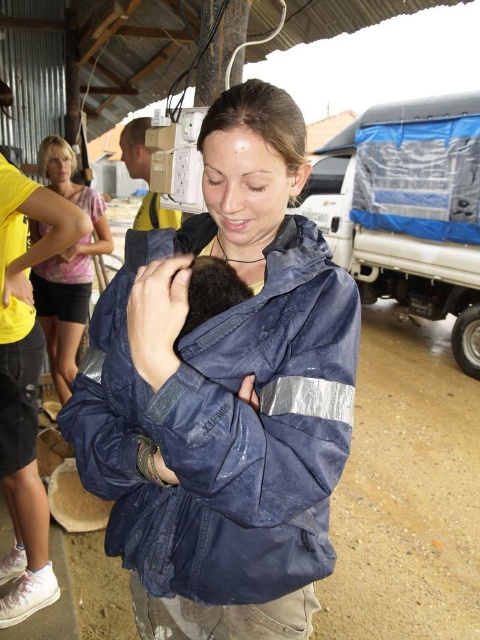
Is point (186, 349) behind point (47, 262)?

No, (186, 349) is closer to viewer.

At what (x,y) coordinates should I click in order to perform the action: click on navy blue jacket at center. Please return your answer as a coordinate pair (x, y). The image size is (480, 640). Looking at the image, I should click on (224, 394).

Is point (229, 147) positioned in front of point (73, 356)?

Yes.

At what (x,y) coordinates should I click in order to perform the action: click on navy blue jacket at center. Please return your answer as a coordinate pair (x, y). The image size is (480, 640). Looking at the image, I should click on (224, 394).